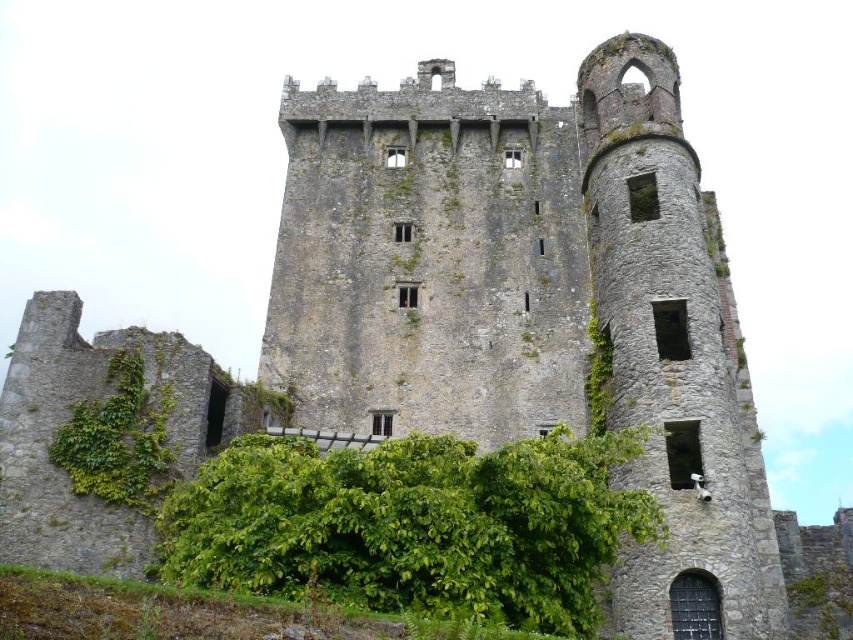
Does green leafy bush at lower center have a lesser width compared to green leafy ivy at lower left?

In fact, green leafy bush at lower center might be wider than green leafy ivy at lower left.

Which is in front, point (514, 460) or point (115, 476)?

Point (514, 460)

Where is `green leafy bush at lower center`? The image size is (853, 640). green leafy bush at lower center is located at coordinates (415, 525).